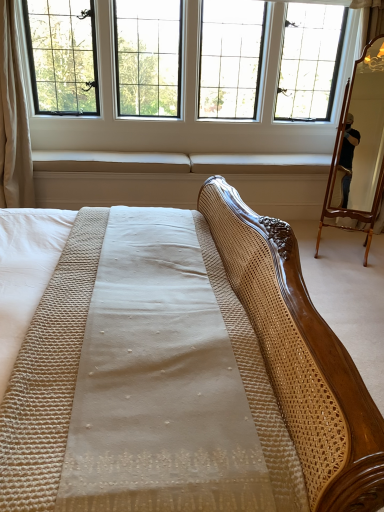
Question: From a real-world perspective, is clear glass window at upper center located higher than white fabric curtain at left?

Choices:
 (A) yes
 (B) no

Answer: (A)

Question: From the image's perspective, does clear glass window at upper center appear lower than white fabric curtain at left?

Choices:
 (A) no
 (B) yes

Answer: (A)

Question: Is clear glass window at upper center not within white fabric curtain at left?

Choices:
 (A) yes
 (B) no

Answer: (A)

Question: Does clear glass window at upper center have a greater width compared to white fabric curtain at left?

Choices:
 (A) no
 (B) yes

Answer: (B)

Question: Is clear glass window at upper center turned away from white fabric curtain at left?

Choices:
 (A) no
 (B) yes

Answer: (A)

Question: From a real-world perspective, is white fabric curtain at left above or below clear glass window at upper center?

Choices:
 (A) above
 (B) below

Answer: (B)

Question: Looking at the image, does white fabric curtain at left seem bigger or smaller compared to clear glass window at upper center?

Choices:
 (A) big
 (B) small

Answer: (B)

Question: Relative to clear glass window at upper center, is white fabric curtain at left in front or behind?

Choices:
 (A) front
 (B) behind

Answer: (A)

Question: Is white fabric curtain at left to the left or to the right of clear glass window at upper center in the image?

Choices:
 (A) left
 (B) right

Answer: (A)

Question: Is point (284, 20) closer or farther from the camera than point (364, 144)?

Choices:
 (A) farther
 (B) closer

Answer: (A)

Question: From the image's perspective, is clear glass window at upper center positioned above or below wooden mirror at right?

Choices:
 (A) above
 (B) below

Answer: (A)

Question: Is clear glass window at upper center situated inside wooden mirror at right or outside?

Choices:
 (A) outside
 (B) inside

Answer: (A)

Question: Relative to wooden mirror at right, is clear glass window at upper center in front or behind?

Choices:
 (A) front
 (B) behind

Answer: (B)

Question: From the image's perspective, is white fabric curtain at left above or below wooden mirror at right?

Choices:
 (A) above
 (B) below

Answer: (A)

Question: Based on their sizes in the image, would you say white fabric curtain at left is bigger or smaller than wooden mirror at right?

Choices:
 (A) big
 (B) small

Answer: (A)